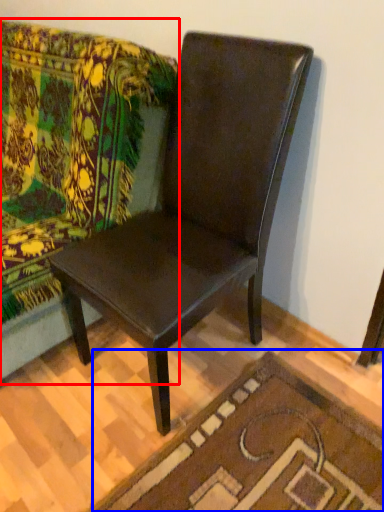
Question: Which of the following is the farthest to the observer, studio couch (highlighted by a red box) or doormat (highlighted by a blue box)?

Choices:
 (A) studio couch
 (B) doormat

Answer: (B)